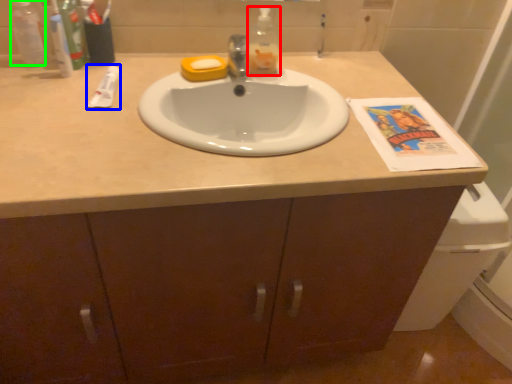
Question: Based on their relative distances, which object is nearer to bottle (highlighted by a red box)? Choose from toothpaste (highlighted by a blue box) and bottle (highlighted by a green box).

Choices:
 (A) toothpaste
 (B) bottle

Answer: (A)